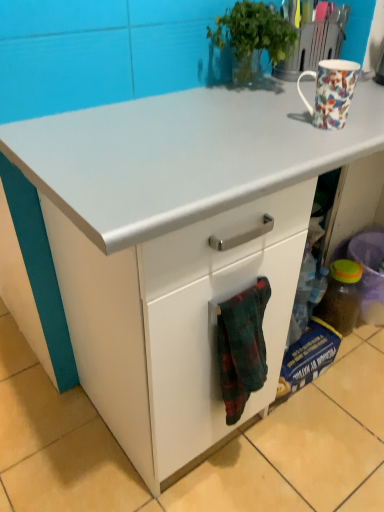
The height and width of the screenshot is (512, 384). Identify the location of vacant area in front of floral porcelain mug at upper right. (317, 146).